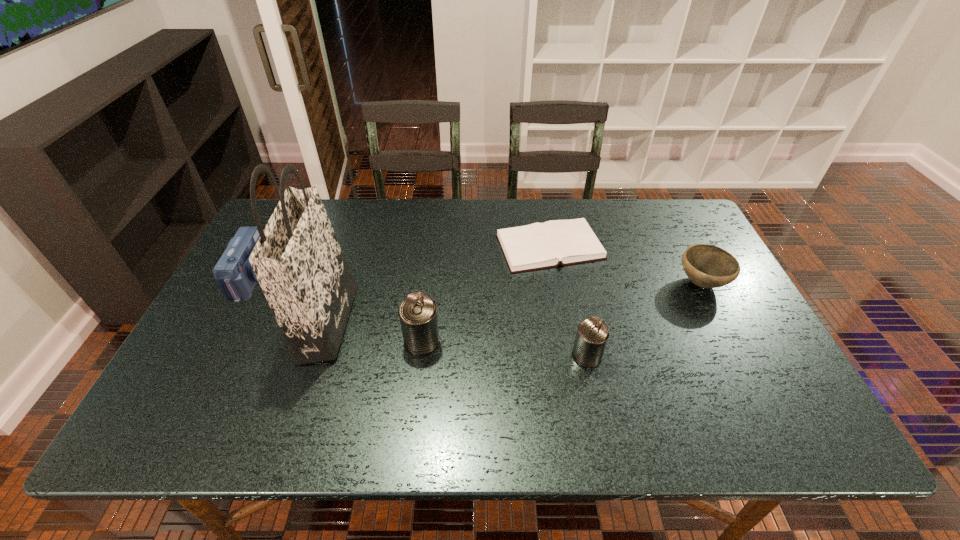
Please show where to add a can on the right while keeping spacing even. Please provide its 2D coordinates. Your answer should be formatted as a tuple, i.e. [(x, y)], where the tuple contains the x and y coordinates of a point satisfying the conditions above.

[(762, 372)]